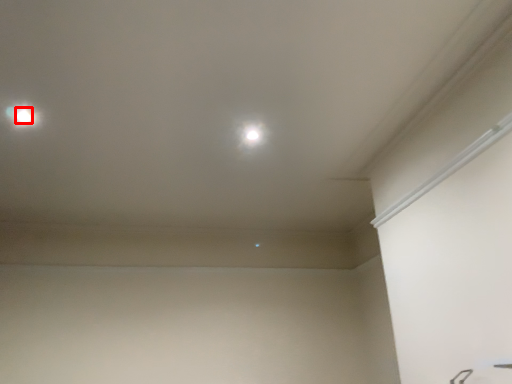
Question: Considering the relative positions of dot (annotated by the red box) and dot in the image provided, where is dot (annotated by the red box) located with respect to the staircase?

Choices:
 (A) right
 (B) left

Answer: (B)